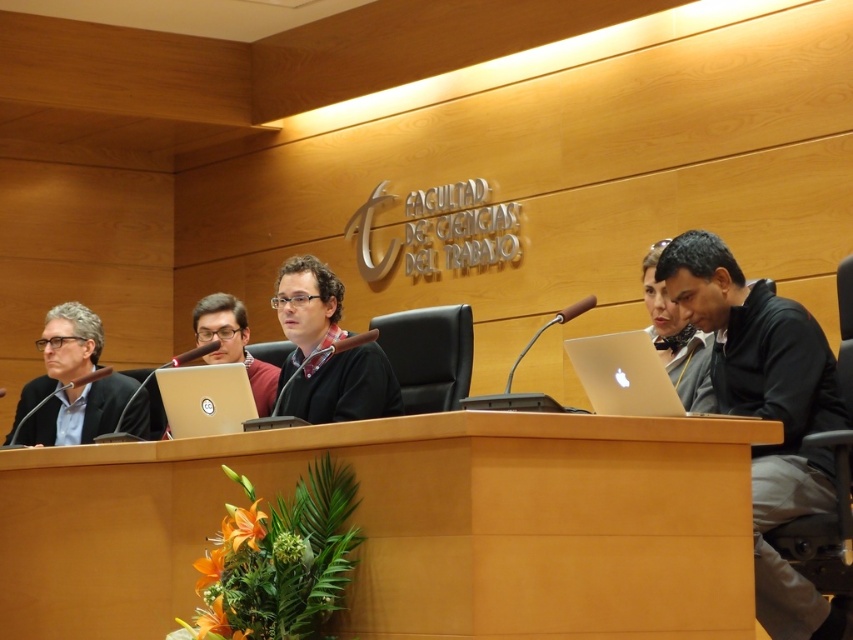
Which is behind, point (572, 353) or point (654, 298)?

Point (654, 298)

Identify the location of silver metallic laptop at right. (624, 374).

The image size is (853, 640). Identify the location of silver metallic laptop at right. (624, 374).

Who is taller, black matte laptop at right or matte black laptop at center?

With more height is black matte laptop at right.

Can you confirm if black matte laptop at right is wider than matte black laptop at center?

Correct, the width of black matte laptop at right exceeds that of matte black laptop at center.

Describe the element at coordinates (767, 413) in the screenshot. I see `black matte laptop at right` at that location.

Identify the location of black matte laptop at right. Image resolution: width=853 pixels, height=640 pixels. (767, 413).

Is point (318, 449) less distant than point (128, 416)?

Yes, point (318, 449) is closer to viewer.

Can you confirm if wooden table at center is bigger than matte black suit at left?

Indeed, wooden table at center has a larger size compared to matte black suit at left.

Is point (485, 554) positioned behind point (54, 355)?

No, (485, 554) is in front of (54, 355).

The height and width of the screenshot is (640, 853). In order to click on wooden table at center in this screenshot , I will do `click(407, 525)`.